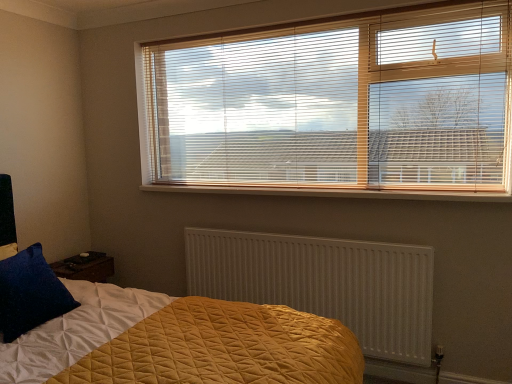
Image resolution: width=512 pixels, height=384 pixels. In order to click on free space above wooden at center (from a real-world perspective) in this screenshot , I will do `click(364, 181)`.